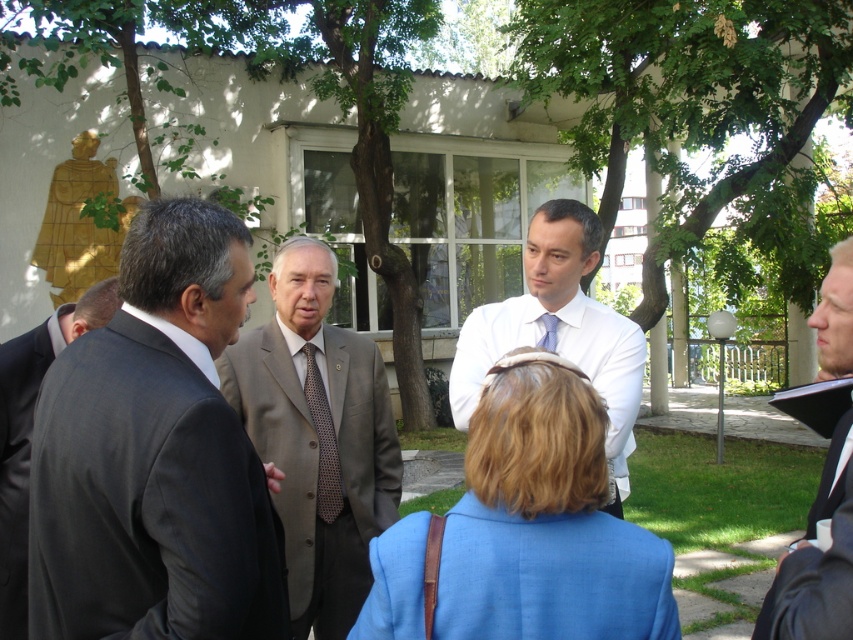
Question: Is dark gray suit at center positioned behind white glossy shirt at center?

Choices:
 (A) yes
 (B) no

Answer: (B)

Question: Considering the relative positions of dark gray suit at center and polka dot silk tie at center in the image provided, where is dark gray suit at center located with respect to polka dot silk tie at center?

Choices:
 (A) left
 (B) right

Answer: (A)

Question: Which object is farther from the camera taking this photo?

Choices:
 (A) blue silk tie at center
 (B) white glossy shirt at center
 (C) dark gray suit at center

Answer: (A)

Question: Which point is closer to the camera?

Choices:
 (A) (547, 346)
 (B) (292, 406)
 (C) (787, 556)

Answer: (C)

Question: Can you confirm if dark gray suit at center is thinner than white glossy shirt at center?

Choices:
 (A) yes
 (B) no

Answer: (A)

Question: Which object is positioned farthest from the dark gray suit at center?

Choices:
 (A) dark gray suit at left
 (B) blonde hair at right
 (C) blue silk tie at center
 (D) polka dot silk tie at center

Answer: (C)